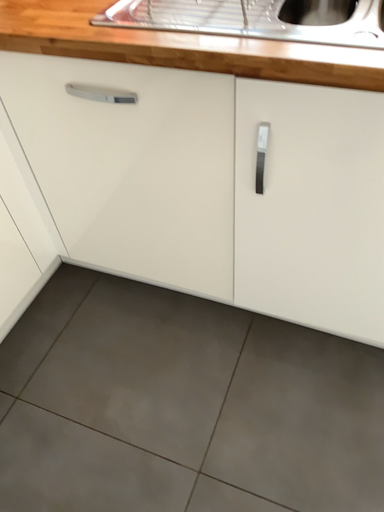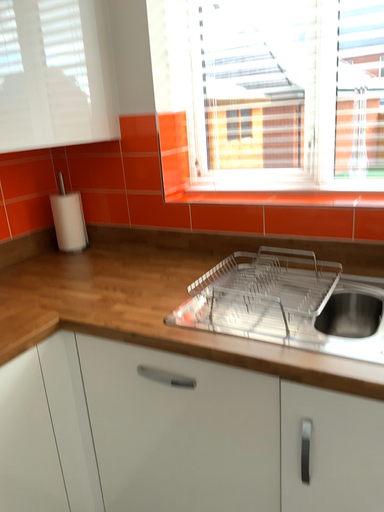
Question: Which way did the camera rotate in the video?

Choices:
 (A) rotated downward
 (B) rotated upward

Answer: (B)